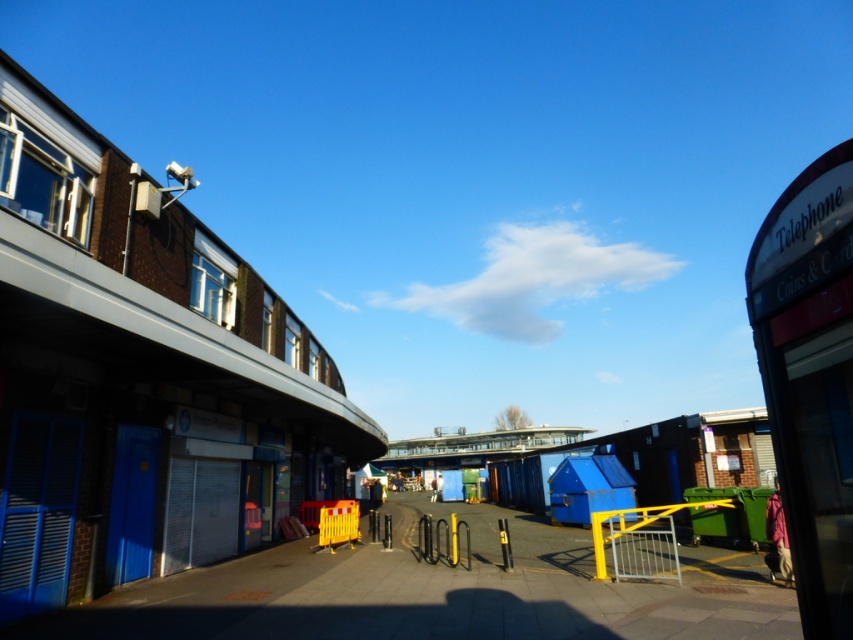
You are a delivery person who needs to park your 2.5 meter wide delivery van. You see the white plastic telephone booth at right. Where should you park your van so it doesn not block the telephone booth?

You should park your van to the left of the white plastic telephone booth at right since the telephone booth is located at the rightmost point of the scene at coordinates (810, 376), leaving space on the left for parking without obstruction.

You are a delivery person needing to park your bike between the blue corrugated metal beach hut at left and the white plastic telephone booth at right. Based on their positions, where should you place your bike to ensure it stays between them?

The blue corrugated metal beach hut at left is located below the white plastic telephone booth at right, so you should park your bike between them horizontally along the ground since the beach hut is lower in position.

You are standing at the point marked as point (140, 372) in the urban street scene. Which object are you facing? Please choose from the following options. The options are the curved building with a modern design on the left, the telephone booth on the right, or the blue corrugated metal beach hut at left.

The point (140, 372) corresponds to the blue corrugated metal beach hut at left, so you are facing the blue corrugated metal beach hut at left.